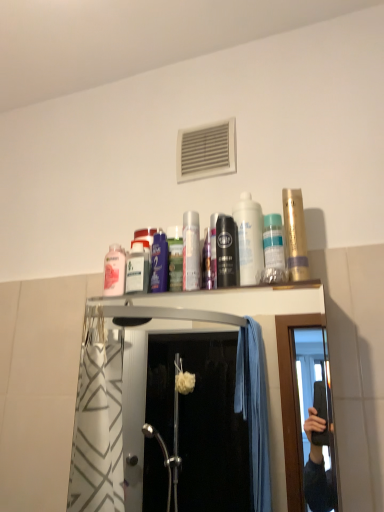
Question: Is the surface of metallic silver can at center, the 6th mouthwash when ordered from right to left, in direct contact with black matte mouthwash at center, the fourth mouthwash positioned from the left?

Choices:
 (A) yes
 (B) no

Answer: (A)

Question: Is metallic silver can at center, the 6th mouthwash when ordered from right to left, to the left of black matte mouthwash at center, the fourth mouthwash positioned from the left, from the viewer's perspective?

Choices:
 (A) no
 (B) yes

Answer: (B)

Question: Considering the relative sizes of metallic silver can at center, the 6th mouthwash when ordered from right to left, and black matte mouthwash at center, acting as the 4th mouthwash starting from the right, in the image provided, is metallic silver can at center, the 6th mouthwash when ordered from right to left, bigger than black matte mouthwash at center, acting as the 4th mouthwash starting from the right,?

Choices:
 (A) no
 (B) yes

Answer: (B)

Question: Does metallic silver can at center, the 6th mouthwash when ordered from right to left, come behind black matte mouthwash at center, acting as the 4th mouthwash starting from the right?

Choices:
 (A) yes
 (B) no

Answer: (A)

Question: Are metallic silver can at center, the second mouthwash viewed from the left, and black matte mouthwash at center, acting as the 4th mouthwash starting from the right, located far from each other?

Choices:
 (A) no
 (B) yes

Answer: (A)

Question: Based on their sizes in the image, would you say translucent plastic mouthwash at upper center, the sixth mouthwash viewed from the left, is bigger or smaller than metallic silver mouthwash at center, which appears as the fifth mouthwash when viewed from the right?

Choices:
 (A) small
 (B) big

Answer: (B)

Question: In the image, is translucent plastic mouthwash at upper center, the sixth mouthwash viewed from the left, positioned in front of or behind metallic silver mouthwash at center, which appears as the fifth mouthwash when viewed from the right?

Choices:
 (A) behind
 (B) front

Answer: (B)

Question: Considering the relative positions of translucent plastic mouthwash at upper center, the sixth mouthwash viewed from the left, and metallic silver mouthwash at center, which appears as the fifth mouthwash when viewed from the right, in the image provided, is translucent plastic mouthwash at upper center, the sixth mouthwash viewed from the left, to the left or to the right of metallic silver mouthwash at center, which appears as the fifth mouthwash when viewed from the right,?

Choices:
 (A) right
 (B) left

Answer: (A)

Question: Choose the correct answer: Is translucent plastic mouthwash at upper center, the sixth mouthwash viewed from the left, inside metallic silver mouthwash at center, which appears as the fifth mouthwash when viewed from the right, or outside it?

Choices:
 (A) outside
 (B) inside

Answer: (A)

Question: From their relative heights in the image, would you say white glossy mouthwash at center, placed as the third mouthwash when sorted from right to left, is taller or shorter than black matte mouthwash at center, the fourth mouthwash positioned from the left?

Choices:
 (A) tall
 (B) short

Answer: (A)

Question: Is white glossy mouthwash at center, placed as the third mouthwash when sorted from right to left, spatially inside black matte mouthwash at center, the fourth mouthwash positioned from the left, or outside of it?

Choices:
 (A) outside
 (B) inside

Answer: (A)

Question: In the image, is white glossy mouthwash at center, placed as the third mouthwash when sorted from right to left, on the left side or the right side of black matte mouthwash at center, acting as the 4th mouthwash starting from the right?

Choices:
 (A) left
 (B) right

Answer: (B)

Question: From the image's perspective, is white glossy mouthwash at center, placed as the third mouthwash when sorted from right to left, above or below black matte mouthwash at center, the fourth mouthwash positioned from the left?

Choices:
 (A) above
 (B) below

Answer: (A)

Question: In terms of width, does metallic silver can at center, the second mouthwash viewed from the left, look wider or thinner when compared to white glossy mouthwash at center, the 5th mouthwash viewed from the left?

Choices:
 (A) thin
 (B) wide

Answer: (A)

Question: Is point (190, 268) closer or farther from the camera than point (251, 221)?

Choices:
 (A) closer
 (B) farther

Answer: (A)